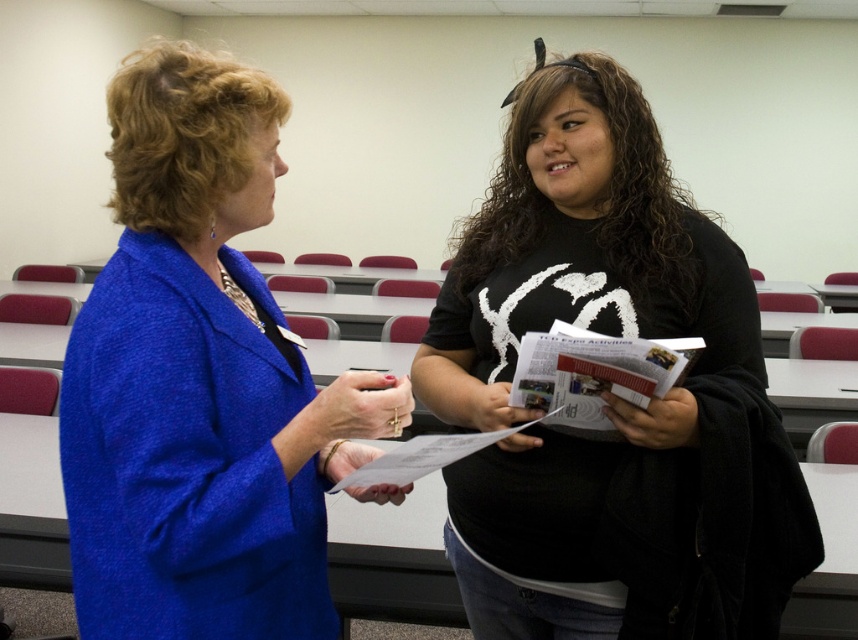
Question: Which object appears closest to the camera in this image?

Choices:
 (A) blue textured blazer at left
 (B) black matte shirt at center

Answer: (A)

Question: Does blue textured blazer at left have a larger size compared to black matte shirt at center?

Choices:
 (A) yes
 (B) no

Answer: (B)

Question: Which point is farther to the camera?

Choices:
 (A) black matte shirt at center
 (B) blue textured blazer at left

Answer: (A)

Question: Does blue textured blazer at left have a lesser width compared to black matte shirt at center?

Choices:
 (A) yes
 (B) no

Answer: (A)

Question: Observing the image, what is the correct spatial positioning of blue textured blazer at left in reference to black matte shirt at center?

Choices:
 (A) below
 (B) above

Answer: (B)